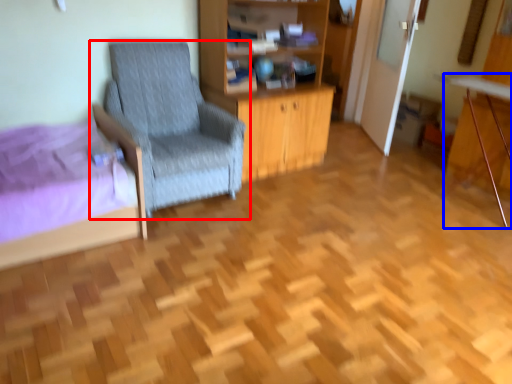
Question: Which point is further to the camera, chair (highlighted by a red box) or computer desk (highlighted by a blue box)?

Choices:
 (A) chair
 (B) computer desk

Answer: (B)